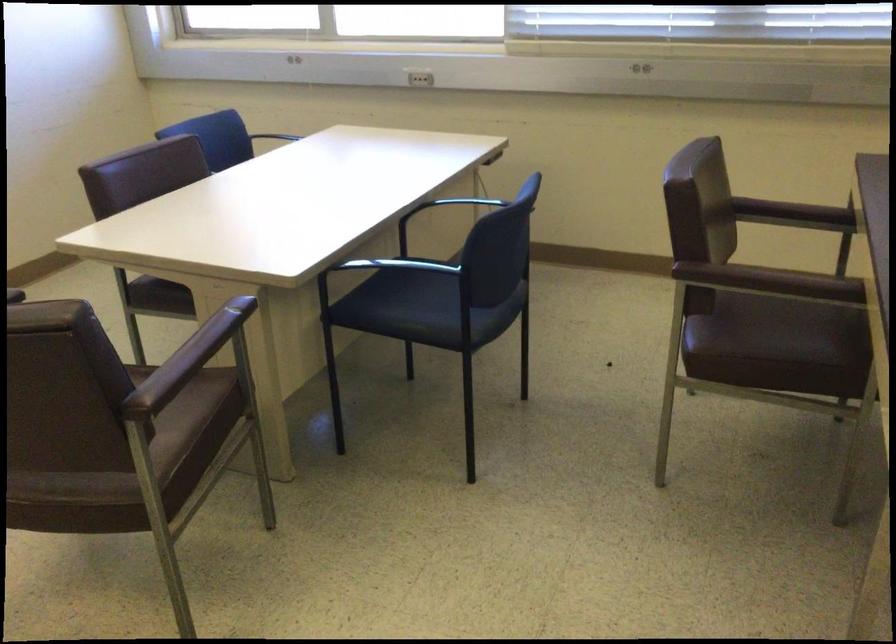
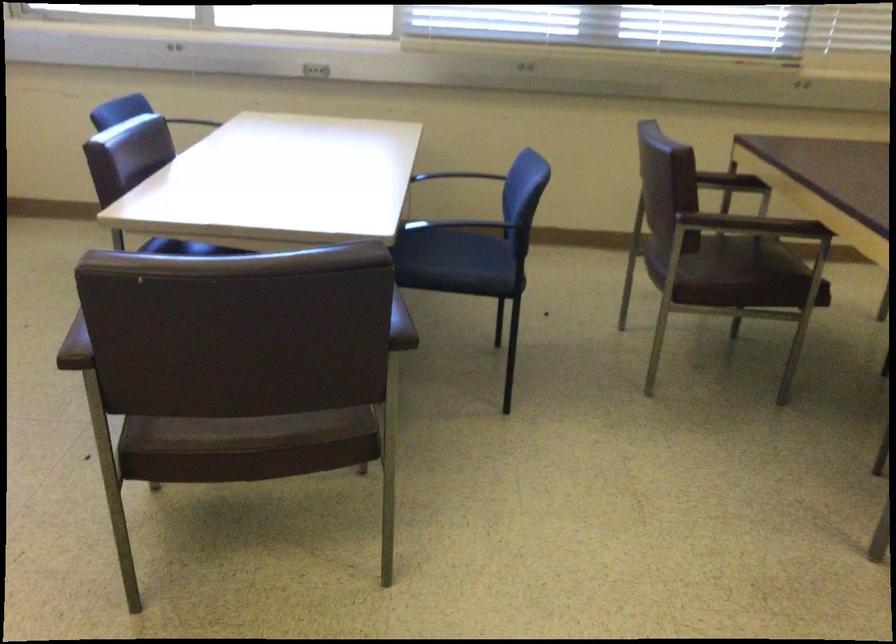
Find the pixel in the second image that matches point (442, 297) in the first image.

(458, 261)